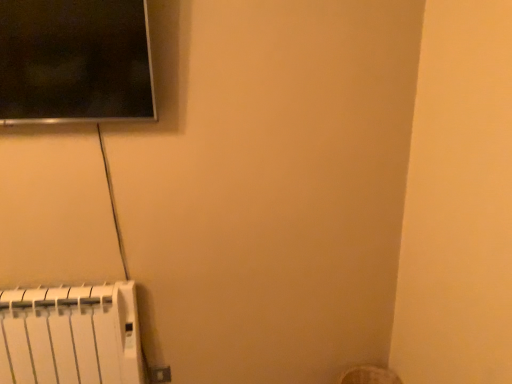
This screenshot has height=384, width=512. What do you see at coordinates (70, 335) in the screenshot? I see `white plastic radiator at lower left` at bounding box center [70, 335].

This screenshot has width=512, height=384. In order to click on white plastic radiator at lower left in this screenshot , I will do `click(70, 335)`.

Identify the location of white plastic electric outlet at lower left. (159, 375).

What do you see at coordinates (159, 375) in the screenshot? I see `white plastic electric outlet at lower left` at bounding box center [159, 375].

This screenshot has width=512, height=384. I want to click on white plastic radiator at lower left, so click(70, 335).

Considering the relative positions of white plastic electric outlet at lower left and white plastic radiator at lower left in the image provided, is white plastic electric outlet at lower left to the left of white plastic radiator at lower left from the viewer's perspective?

No, white plastic electric outlet at lower left is not to the left of white plastic radiator at lower left.

Is the position of white plastic electric outlet at lower left less distant than that of white plastic radiator at lower left?

No, it is behind white plastic radiator at lower left.

Between point (152, 370) and point (96, 296), which one is positioned behind?

The point (152, 370) is behind.

From the image's perspective, between white plastic electric outlet at lower left and white plastic radiator at lower left, who is located below?

white plastic electric outlet at lower left is shown below in the image.

In the scene shown: From a real-world perspective, who is located lower, white plastic electric outlet at lower left or white plastic radiator at lower left?

white plastic electric outlet at lower left is physically lower.

Between white plastic electric outlet at lower left and white plastic radiator at lower left, which one has smaller width?

With smaller width is white plastic electric outlet at lower left.

Can you confirm if white plastic electric outlet at lower left is shorter than white plastic radiator at lower left?

Yes.

In the scene shown: Is white plastic electric outlet at lower left bigger or smaller than white plastic radiator at lower left?

Considering their sizes, white plastic electric outlet at lower left takes up less space than white plastic radiator at lower left.

Could white plastic radiator at lower left be considered to be inside white plastic electric outlet at lower left?

No.

Does white plastic electric outlet at lower left touch white plastic radiator at lower left?

No, white plastic electric outlet at lower left is not with white plastic radiator at lower left.

Is white plastic electric outlet at lower left facing away from white plastic radiator at lower left?

white plastic electric outlet at lower left is not turned away from white plastic radiator at lower left.

This screenshot has height=384, width=512. What are the coordinates of `electric outlet behind the white plastic radiator at lower left` in the screenshot? It's located at (159, 375).

Considering the relative positions of white plastic radiator at lower left and white plastic electric outlet at lower left in the image provided, is white plastic radiator at lower left to the left of white plastic electric outlet at lower left from the viewer's perspective?

Yes.

From the picture: Between white plastic radiator at lower left and white plastic electric outlet at lower left, which one is positioned in front?

white plastic radiator at lower left.

Does point (64, 324) lie in front of point (162, 373)?

Yes, it is in front of point (162, 373).

From the image's perspective, is white plastic radiator at lower left over white plastic electric outlet at lower left?

Yes, from the image's perspective, white plastic radiator at lower left is above white plastic electric outlet at lower left.

From a real-world perspective, between white plastic radiator at lower left and white plastic electric outlet at lower left, who is vertically lower?

In real-world perspective, white plastic electric outlet at lower left is lower.

Based on the photo, considering the sizes of objects white plastic radiator at lower left and white plastic electric outlet at lower left in the image provided, who is wider, white plastic radiator at lower left or white plastic electric outlet at lower left?

With larger width is white plastic radiator at lower left.

Considering the sizes of objects white plastic radiator at lower left and white plastic electric outlet at lower left in the image provided, who is taller, white plastic radiator at lower left or white plastic electric outlet at lower left?

white plastic radiator at lower left.

Considering the sizes of objects white plastic radiator at lower left and white plastic electric outlet at lower left in the image provided, who is bigger, white plastic radiator at lower left or white plastic electric outlet at lower left?

white plastic radiator at lower left is bigger.

Is white plastic radiator at lower left spatially inside white plastic electric outlet at lower left, or outside of it?

white plastic radiator at lower left exists outside the volume of white plastic electric outlet at lower left.

Is white plastic radiator at lower left next to white plastic electric outlet at lower left and touching it?

No, white plastic radiator at lower left is not in contact with white plastic electric outlet at lower left.

Is white plastic radiator at lower left oriented away from white plastic electric outlet at lower left?

No, white plastic radiator at lower left's orientation is not away from white plastic electric outlet at lower left.

Can you tell me how much white plastic radiator at lower left and white plastic electric outlet at lower left differ in facing direction?

0.91 degrees.

This screenshot has width=512, height=384. Identify the location of radiator in front of the white plastic electric outlet at lower left. (70, 335).

Locate an element on the screen. Image resolution: width=512 pixels, height=384 pixels. radiator on the left side of white plastic electric outlet at lower left is located at coordinates (70, 335).

I want to click on electric outlet below the white plastic radiator at lower left (from the image's perspective), so click(159, 375).